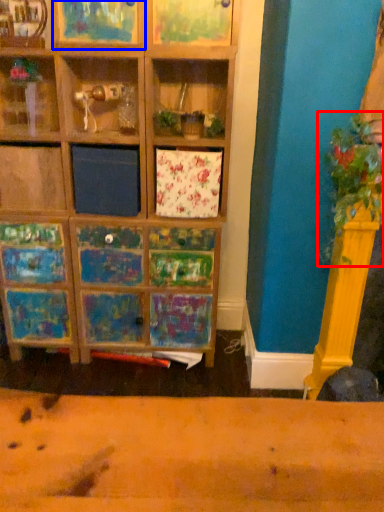
Question: Which object is closer to the camera taking this photo, plant (highlighted by a red box) or shelf (highlighted by a blue box)?

Choices:
 (A) plant
 (B) shelf

Answer: (A)